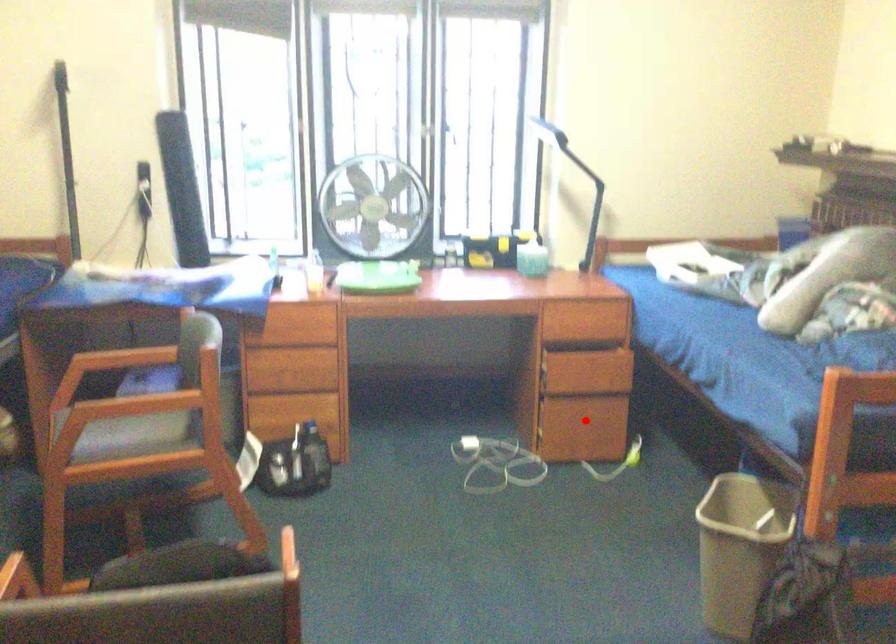
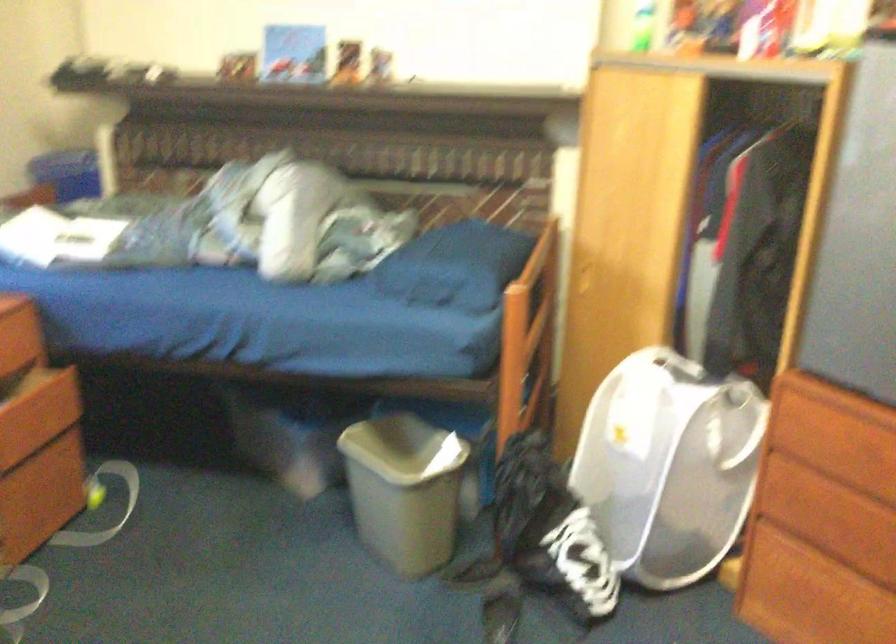
Where in the second image is the point corresponding to the highlighted location from the first image?

(39, 482)